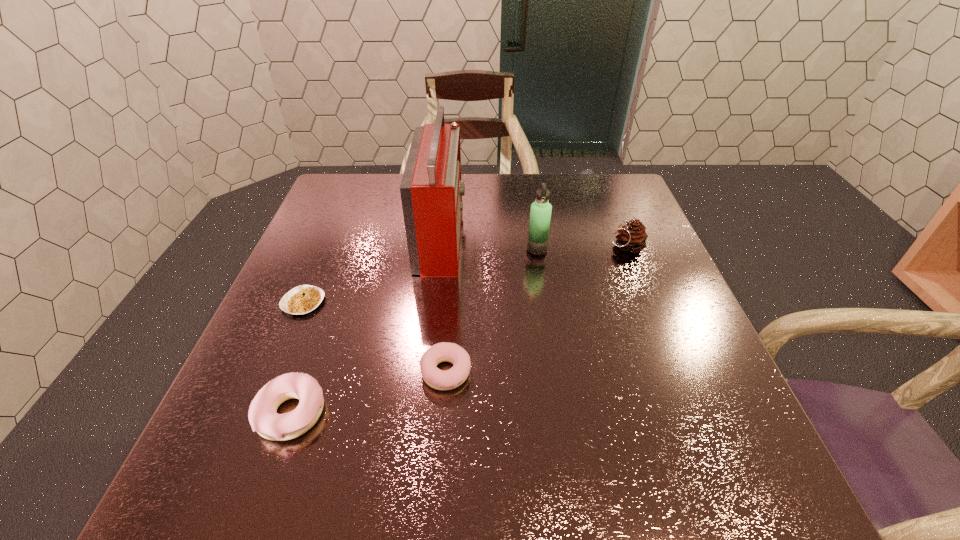
The height and width of the screenshot is (540, 960). Identify the location of the fourth tallest object. (263, 417).

This screenshot has width=960, height=540. Find the location of `the taller doughnut`. the taller doughnut is located at coordinates (263, 417).

At what (x,y) coordinates should I click in order to perform the action: click on the right doughnut. Please return your answer as a coordinate pair (x, y). This screenshot has height=540, width=960. Looking at the image, I should click on (438, 379).

This screenshot has width=960, height=540. Find the location of `the shorter doughnut`. the shorter doughnut is located at coordinates (438, 379).

This screenshot has width=960, height=540. I want to click on pinecone, so click(x=632, y=237).

Identify the location of the fourth shortest object. This screenshot has width=960, height=540. (632, 237).

Locate an element on the screen. This screenshot has height=540, width=960. legume is located at coordinates (302, 299).

Identify the location of the fourth farthest object. (302, 299).

Locate an element on the screen. radio receiver is located at coordinates (431, 189).

The image size is (960, 540). I want to click on thermos bottle, so click(x=540, y=215).